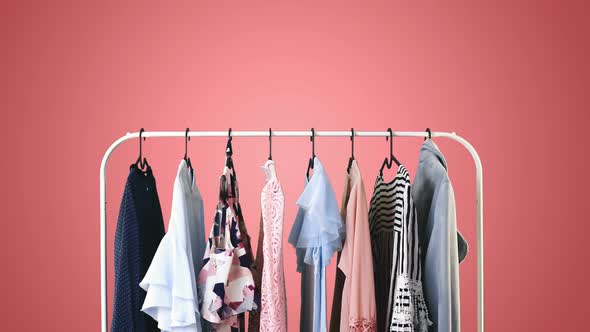
This screenshot has height=332, width=590. In order to click on hanger in this screenshot , I will do `click(431, 137)`, `click(392, 141)`, `click(349, 144)`, `click(311, 144)`, `click(271, 146)`, `click(229, 143)`, `click(189, 143)`, `click(140, 143)`.